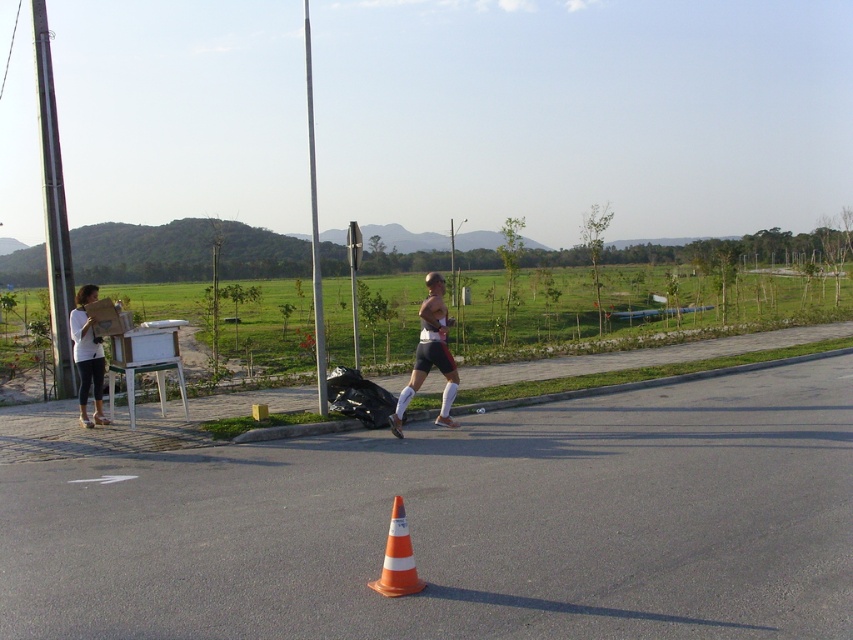
You are a pedestrian standing at the orange reflective cone at center. You want to catch up to the person wearing the matte white shorts at center who is walking away from you. If you start running at a speed of 5 meters per second, how many seconds will it take you to reach them?

The distance between the matte white shorts at center and orange reflective cone at center is 6.13 meters. If you run at 5 meters per second, it would take approximately 1.23 seconds to reach them. However, this calculation assumes the person in matte white shorts is stationary, which may not be the case. If they continue moving away at their current pace, the time required would be longer.